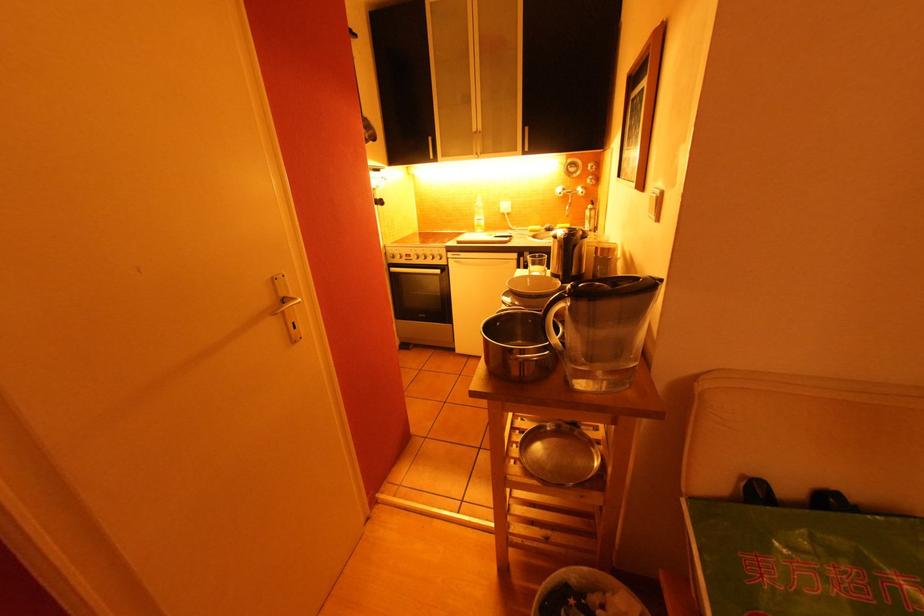
The image size is (924, 616). I want to click on black kettle handle, so click(572, 265).